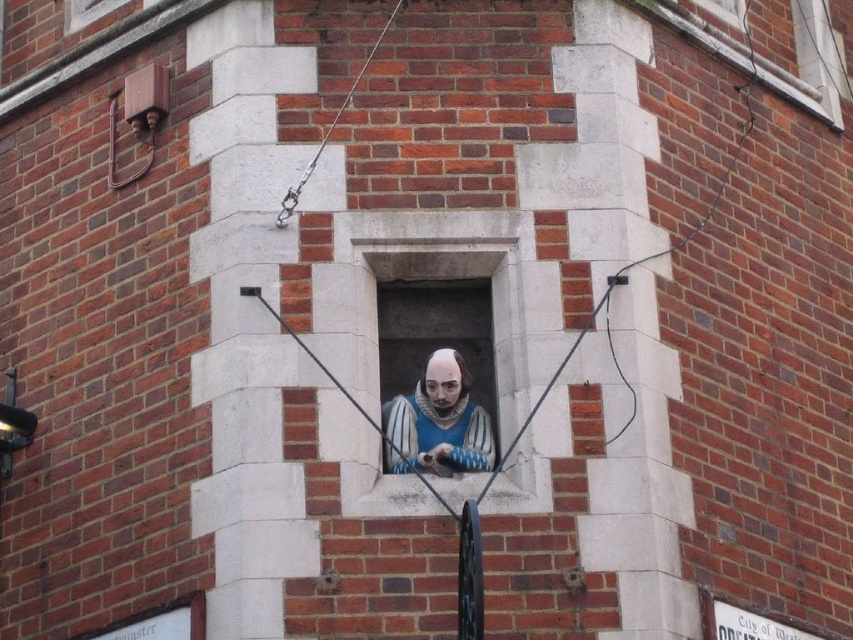
Can you confirm if matte blue fabric at center is wider than white stone window at upper right?

Incorrect, matte blue fabric at center's width does not surpass white stone window at upper right's.

Which is more to the left, matte blue fabric at center or white stone window at upper right?

matte blue fabric at center is more to the left.

What do you see at coordinates (437, 422) in the screenshot? The image size is (853, 640). I see `matte blue fabric at center` at bounding box center [437, 422].

This screenshot has width=853, height=640. Find the location of `matte blue fabric at center`. matte blue fabric at center is located at coordinates (437, 422).

Consider the image. Does white stone window at upper right lie behind white stone window at upper center?

No, white stone window at upper right is closer to the viewer.

Is white stone window at upper right bigger than white stone window at upper center?

Correct, white stone window at upper right is larger in size than white stone window at upper center.

Is point (686, 8) more distant than point (88, 13)?

No, (686, 8) is closer to viewer.

The image size is (853, 640). In order to click on white stone window at upper right in this screenshot , I will do `click(769, 60)`.

Can you confirm if matte blue fabric at center is positioned to the left of white stone window at upper center?

In fact, matte blue fabric at center is to the right of white stone window at upper center.

From the picture: Can you confirm if matte blue fabric at center is positioned below white stone window at upper center?

Yes.

Who is more distant from viewer, (461, 403) or (94, 1)?

The point (94, 1) is more distant.

Where is `matte blue fabric at center`? matte blue fabric at center is located at coordinates (437, 422).